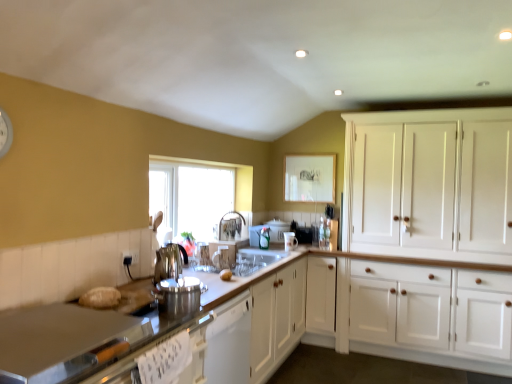
What do you see at coordinates (169, 262) in the screenshot? This screenshot has height=384, width=512. I see `polished stainless steel kettle at center, the second appliance viewed from the front` at bounding box center [169, 262].

Describe the element at coordinates (178, 297) in the screenshot. I see `satin silver kettle at center, the 5th appliance from the back` at that location.

The image size is (512, 384). I want to click on satin silver kettle at center, acting as the first appliance starting from the front, so click(x=178, y=297).

The width and height of the screenshot is (512, 384). Find the location of `metallic silver toaster at center, which is the fifth appliance from left to right`. metallic silver toaster at center, which is the fifth appliance from left to right is located at coordinates (303, 233).

Where is `polished stainless steel kettle at center, the fourth appliance viewed from the back`? The width and height of the screenshot is (512, 384). polished stainless steel kettle at center, the fourth appliance viewed from the back is located at coordinates (169, 262).

Is point (6, 116) positioned behind point (221, 279)?

That is False.

Is bread matte at center a part of white plastic clock at upper left?

No, bread matte at center is not surrounded by white plastic clock at upper left.

From the image's perspective, would you say white plastic clock at upper left is positioned over bread matte at center?

Indeed, from the image's perspective, white plastic clock at upper left is shown above bread matte at center.

From the image's perspective, is bread matte at center on top of white glossy mug at center, positioned as the third appliance in front-to-back order?

No, from the image's perspective, bread matte at center is not over white glossy mug at center, positioned as the third appliance in front-to-back order.

Which object is more forward, bread matte at center or white glossy mug at center, the fourth appliance viewed from the left?

bread matte at center is closer to the camera.

What's the angular difference between bread matte at center and white glossy mug at center, marked as the second appliance in a right-to-left arrangement,'s facing directions?

0.00309 degrees separate the facing orientations of bread matte at center and white glossy mug at center, marked as the second appliance in a right-to-left arrangement.

Does bread matte at center touch polished stainless steel faucet at center?

No.

Which is more to the left, bread matte at center or polished stainless steel faucet at center?

From the viewer's perspective, polished stainless steel faucet at center appears more on the left side.

What are the coordinates of `faucet on the left of bread matte at center` in the screenshot? It's located at (231, 226).

Based on the photo, which is closer to the camera, (221, 278) or (234, 222)?

Point (221, 278).

Is white glossy mug at center, the fourth appliance viewed from the left, wider than polished stainless steel faucet at center?

No, white glossy mug at center, the fourth appliance viewed from the left, is not wider than polished stainless steel faucet at center.

In the image, is white glossy mug at center, positioned as the third appliance in front-to-back order, positioned in front of or behind polished stainless steel faucet at center?

white glossy mug at center, positioned as the third appliance in front-to-back order, is positioned farther from the viewer than polished stainless steel faucet at center.

What's the angular difference between white glossy mug at center, the fourth appliance viewed from the left, and polished stainless steel faucet at center's facing directions?

0.00119 degrees.

Who is shorter, white glossy mug at center, positioned as the third appliance in front-to-back order, or polished stainless steel faucet at center?

white glossy mug at center, positioned as the third appliance in front-to-back order.

Is point (9, 144) positioned before point (219, 237)?

Yes, point (9, 144) is in front of point (219, 237).

Is white plastic clock at upper left not near polished stainless steel faucet at center?

Yes, white plastic clock at upper left and polished stainless steel faucet at center are located far from each other.

Which object is closer to the camera, white plastic clock at upper left or polished stainless steel faucet at center?

white plastic clock at upper left is more forward.

Based on the photo, can you tell me how much white plastic clock at upper left and polished stainless steel faucet at center differ in facing direction?

white plastic clock at upper left and polished stainless steel faucet at center are facing 0.00336 degrees away from each other.

Is white plastic toaster at center, the 2th appliance when ordered from back to front, completely or partially outside of bread matte at center?

Yes, white plastic toaster at center, the 2th appliance when ordered from back to front, is located beyond the bounds of bread matte at center.

Could you tell me if white plastic toaster at center, the 2th appliance when ordered from back to front, is turned towards bread matte at center?

No, white plastic toaster at center, the 2th appliance when ordered from back to front, does not turn towards bread matte at center.

Considering the positions of objects white plastic toaster at center, the third appliance viewed from the left, and bread matte at center in the image provided, who is behind, white plastic toaster at center, the third appliance viewed from the left, or bread matte at center?

white plastic toaster at center, the third appliance viewed from the left.

Between white plastic toaster at center, the third appliance viewed from the left, and bread matte at center, which one appears on the right side from the viewer's perspective?

white plastic toaster at center, the third appliance viewed from the left.

Where is `window that is above the white plastic toaster at center, the 3th appliance when ordered from right to left (from a real-world perspective)`? The height and width of the screenshot is (384, 512). window that is above the white plastic toaster at center, the 3th appliance when ordered from right to left (from a real-world perspective) is located at coordinates (195, 195).

Measure the distance from clear glass window at center to white plastic toaster at center, the 2th appliance when ordered from back to front.

clear glass window at center is 31.90 inches away from white plastic toaster at center, the 2th appliance when ordered from back to front.

Who is more distant, clear glass window at center or white plastic toaster at center, the 2th appliance when ordered from back to front?

Positioned behind is white plastic toaster at center, the 2th appliance when ordered from back to front.

From the image's perspective, is clear glass window at center positioned above or below white plastic toaster at center, the third appliance viewed from the left?

clear glass window at center is situated higher than white plastic toaster at center, the third appliance viewed from the left, in the image.

At what (x,y) coordinates should I click in order to perform the action: click on food below the white plastic clock at upper left (from the image's perspective). Please return your answer as a coordinate pair (x, y). Looking at the image, I should click on (226, 275).

This screenshot has height=384, width=512. In the image, there is a white glossy mug at center, marked as the second appliance in a right-to-left arrangement. In order to click on food below it (from a real-world perspective) in this screenshot , I will do `click(226, 275)`.

Estimate the real-world distances between objects in this image. Which object is closer to satin silver kettle at center, acting as the second appliance starting from the left, clear glass window at center or white glossy mug at center, marked as the second appliance in a right-to-left arrangement?

Among the two, clear glass window at center is located nearer to satin silver kettle at center, acting as the second appliance starting from the left.

Looking at the image, which one is located closer to white plastic toaster at center, the 2th appliance when ordered from back to front, polished stainless steel kettle at center, the first appliance when ordered from left to right, or polished stainless steel faucet at center?

polished stainless steel faucet at center is closer to white plastic toaster at center, the 2th appliance when ordered from back to front.

From the image, which object appears to be nearer to white wood cabinet at right, white plastic clock at upper left or white plastic toaster at center, the 3th appliance when ordered from right to left?

Among the two, white plastic toaster at center, the 3th appliance when ordered from right to left, is located nearer to white wood cabinet at right.

When comparing their distances from bread matte at center, does white plastic toaster at center, which is the 4th appliance from front to back, or polished stainless steel kettle at center, the fourth appliance viewed from the back, seem closer?

Among the two, polished stainless steel kettle at center, the fourth appliance viewed from the back, is located nearer to bread matte at center.

From the image, which object appears to be farther from metallic silver toaster at center, which is the fifth appliance from left to right, satin silver kettle at center, the 5th appliance from the back, or white wood cabinet at right?

satin silver kettle at center, the 5th appliance from the back, is further to metallic silver toaster at center, which is the fifth appliance from left to right.

Considering their positions, is bread matte at center positioned further to white plastic clock at upper left than white wood cabinet at right?

Based on the image, white wood cabinet at right appears to be further to white plastic clock at upper left.

Looking at the image, which one is located further to clear glass window at center, satin silver kettle at center, which appears as the fourth appliance when viewed from the right, or white plastic toaster at center, which is the 4th appliance from front to back?

satin silver kettle at center, which appears as the fourth appliance when viewed from the right, lies further to clear glass window at center than the other object.

From the image, which object appears to be farther from bread matte at center, white wood cabinet at right or polished stainless steel faucet at center?

white wood cabinet at right is further to bread matte at center.

The height and width of the screenshot is (384, 512). I want to click on cabinetry between satin silver kettle at center, which appears as the fourth appliance when viewed from the right, and white glossy mug at center, the fourth appliance viewed from the left, in the front-back direction, so click(x=432, y=184).

At what (x,y) coordinates should I click in order to perform the action: click on appliance between satin silver kettle at center, acting as the first appliance starting from the front, and clear glass window at center from front to back. Please return your answer as a coordinate pair (x, y). Looking at the image, I should click on (169, 262).

Where is `food located between white plastic clock at upper left and white glossy mug at center, the fourth appliance viewed from the left, in the depth direction`? The height and width of the screenshot is (384, 512). food located between white plastic clock at upper left and white glossy mug at center, the fourth appliance viewed from the left, in the depth direction is located at coordinates (226, 275).

Identify the location of food situated between polished stainless steel faucet at center and white wood cabinet at right from left to right. (226, 275).